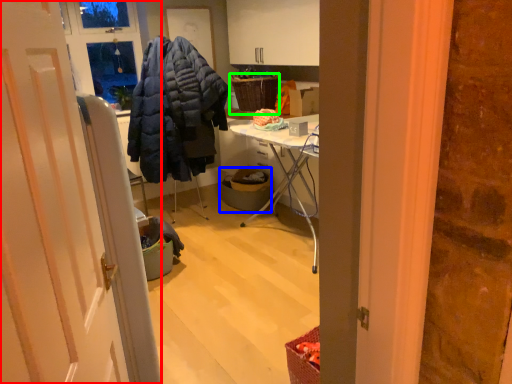
Question: Based on their relative distances, which object is nearer to door (highlighted by a red box)? Choose from trash bin/can (highlighted by a blue box) and picnic basket (highlighted by a green box).

Choices:
 (A) trash bin/can
 (B) picnic basket

Answer: (A)